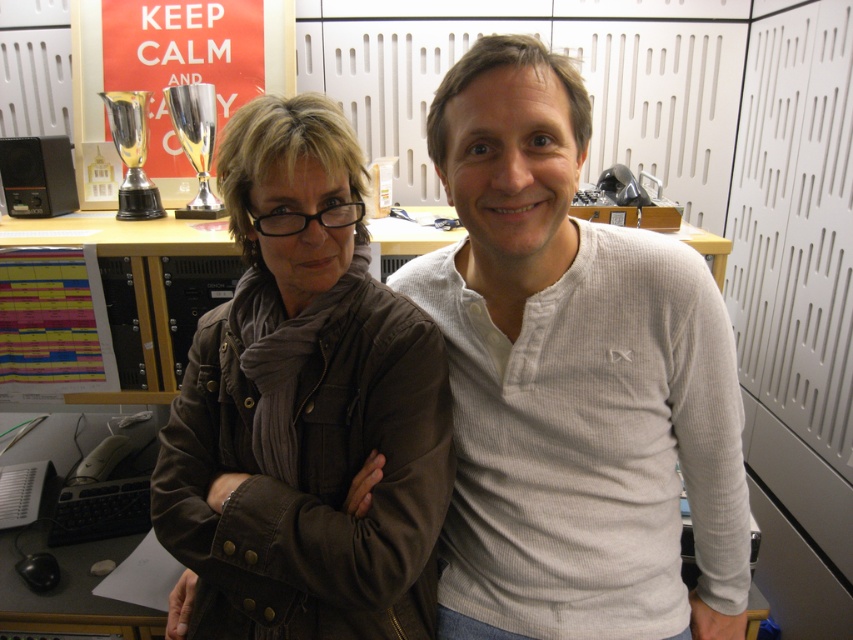
You are an assistant organizing a charity clothing drive. You need to decide which item to place on top of the donation bin. The bin has limited vertical space. Based on the image, which item between the white ribbed sweater at center and the brown leather jacket at center should you choose to ensure it fits without exceeding the bin height?

The white ribbed sweater at center is above the brown leather jacket at center in the image, indicating it is smaller in height. Therefore, placing the white ribbed sweater at center on top would ensure it fits within the bin height limits.

Looking at this image, you are trying to decide which item to place on a narrow shelf that can only fit one of them. Based on their widths, which item between the white ribbed sweater at center and the brown leather jacket at center would you choose to fit on the shelf?

The white ribbed sweater at center might be wider than brown leather jacket at center, so it is possible that the brown leather jacket at center would fit better on the narrow shelf.